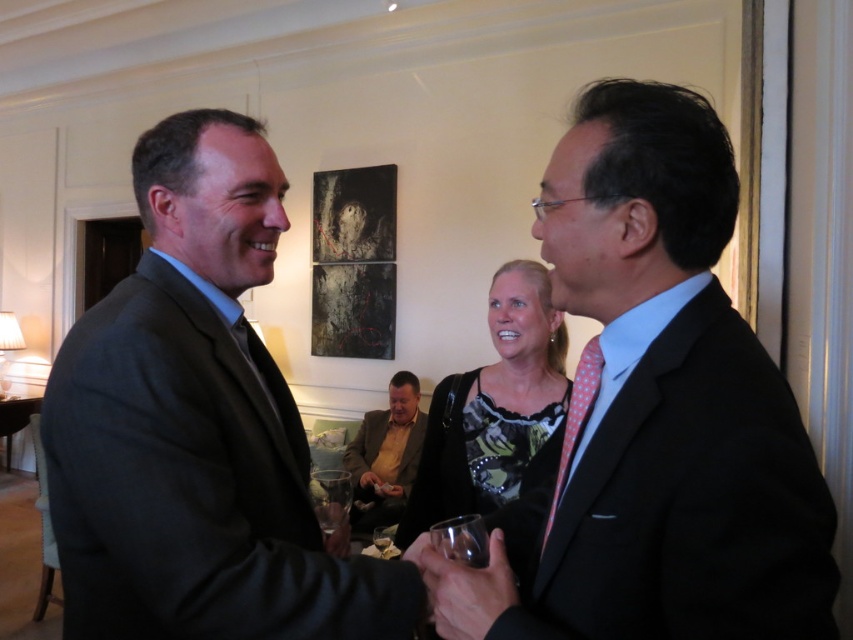
Question: Which object is positioned farthest from the yellowish-brown textured blazer at lower center?

Choices:
 (A) metallic silver cup at center
 (B) printed silk blouse at center
 (C) transparent glass at center
 (D) matte black hand at center

Answer: (A)

Question: Can you confirm if yellowish-brown textured blazer at lower center is wider than matte black hand at center?

Choices:
 (A) yes
 (B) no

Answer: (A)

Question: Which of the following is the farthest from the observer?

Choices:
 (A) (343, 534)
 (B) (653, 451)
 (C) (489, 560)

Answer: (A)

Question: Does pink dotted tie at center appear on the right side of matte black hand at center?

Choices:
 (A) no
 (B) yes

Answer: (B)

Question: Which object is positioned closest to the pink dotted tie at center?

Choices:
 (A) printed silk blouse at center
 (B) dark gray suit at left
 (C) matte black hand at center
 (D) metallic silver cup at center

Answer: (D)

Question: Is metallic glass at center to the left of metallic silver cup at center from the viewer's perspective?

Choices:
 (A) no
 (B) yes

Answer: (A)